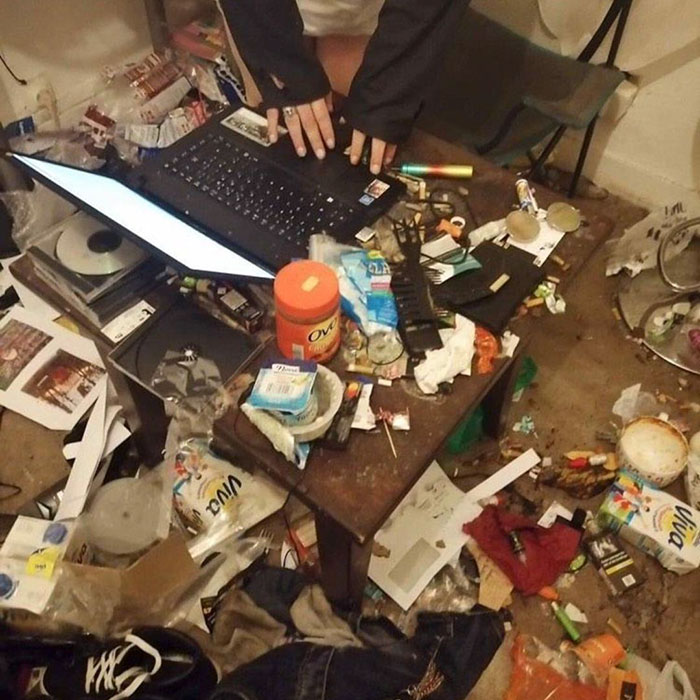
Identify the location of dvd. The image size is (700, 700). (82, 256).